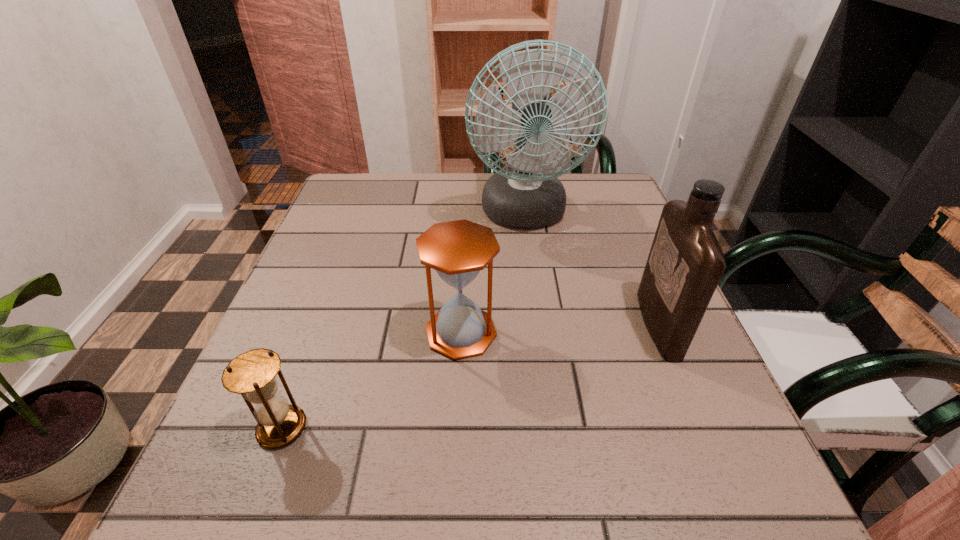
This screenshot has height=540, width=960. I want to click on vacant space at the near edge of the desktop, so click(570, 492).

Where is `vacant space at the left edge of the desktop`? The height and width of the screenshot is (540, 960). vacant space at the left edge of the desktop is located at coordinates (346, 238).

What are the coordinates of `free space at the right edge` in the screenshot? It's located at (578, 222).

In the image, there is a desktop. In order to click on vacant area at the far left corner in this screenshot , I will do `click(366, 176)`.

At what (x,y) coordinates should I click in order to perform the action: click on vacant area at the near left corner. Please return your answer as a coordinate pair (x, y). Looking at the image, I should click on (195, 495).

Where is `vacant space at the far right corner of the desktop`? The width and height of the screenshot is (960, 540). vacant space at the far right corner of the desktop is located at coordinates (575, 210).

This screenshot has width=960, height=540. I want to click on vacant area that lies between the nearer hourglass and the second tallest object, so click(x=470, y=376).

What are the coordinates of `free spot between the leftmost object and the tallest object` in the screenshot? It's located at (403, 321).

Image resolution: width=960 pixels, height=540 pixels. Identify the location of vacant area between the farther hourglass and the nearest object. (372, 380).

The height and width of the screenshot is (540, 960). I want to click on vacant area between the second shortest object and the shorter hourglass, so click(372, 380).